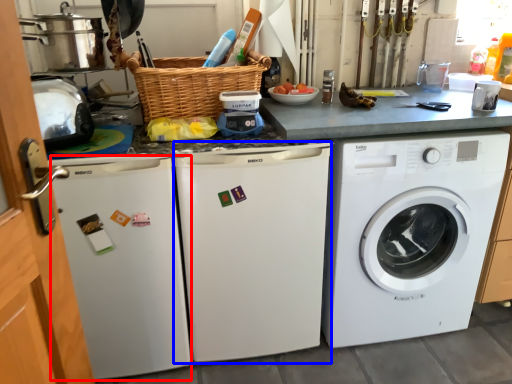
Question: Which object is further to the camera taking this photo, dish washer (highlighted by a red box) or dish washer (highlighted by a blue box)?

Choices:
 (A) dish washer
 (B) dish washer

Answer: (B)